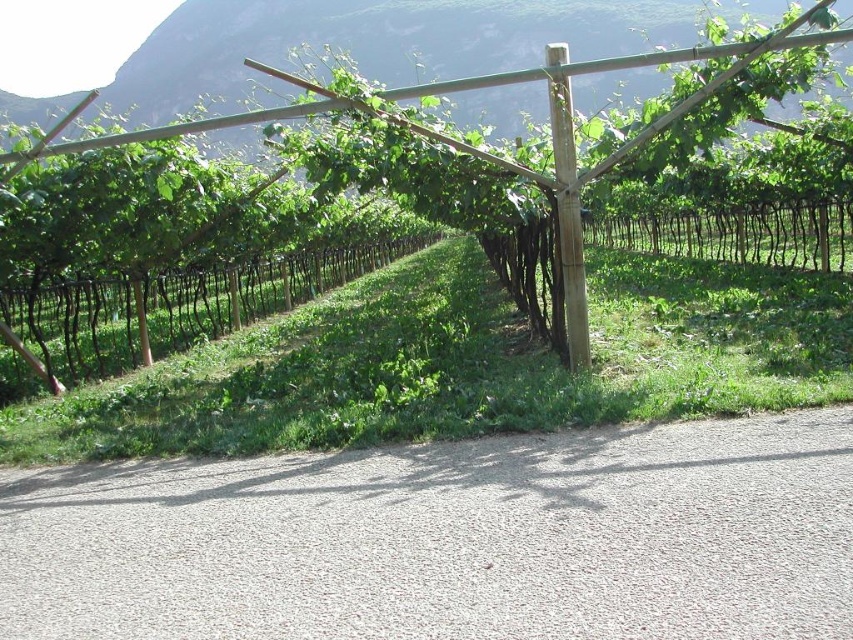
Question: Can you confirm if green wood fence at center is wider than brown wood pole at center?

Choices:
 (A) no
 (B) yes

Answer: (B)

Question: Does gray gravel path at lower center have a lesser width compared to green wood fence at center?

Choices:
 (A) yes
 (B) no

Answer: (A)

Question: Which object is closer to the camera taking this photo?

Choices:
 (A) green wood fence at center
 (B) green bamboo fence at center
 (C) gray gravel path at lower center
 (D) brown wood pole at center

Answer: (C)

Question: Estimate the real-world distances between objects in this image. Which object is farther from the green wood fence at center?

Choices:
 (A) gray gravel path at lower center
 (B) brown wood pole at center

Answer: (B)

Question: Considering the real-world distances, which object is closest to the brown wood pole at center?

Choices:
 (A) green bamboo fence at center
 (B) gray gravel path at lower center
 (C) green wood fence at center

Answer: (B)

Question: Does green wood fence at center have a lesser width compared to brown wood pole at center?

Choices:
 (A) yes
 (B) no

Answer: (B)